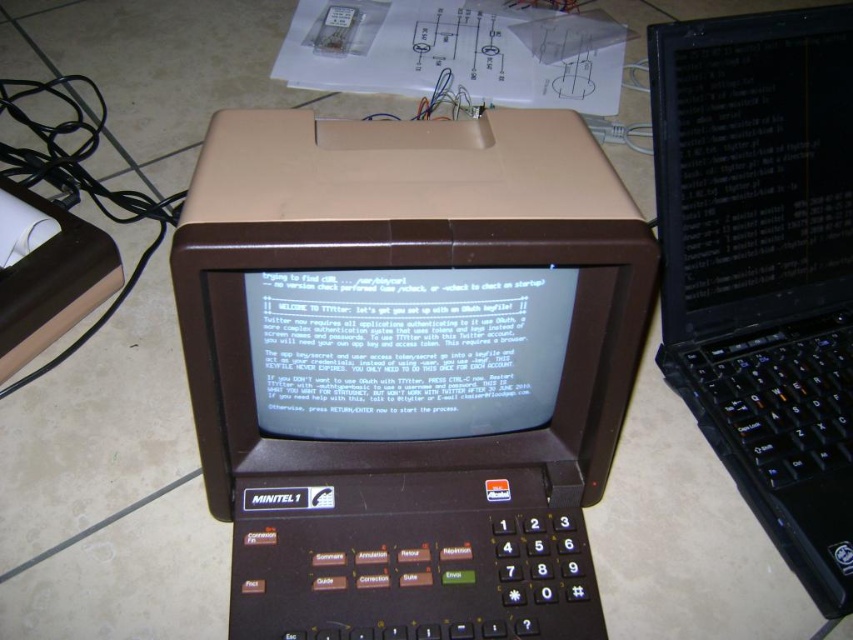
You are a technician who needs to place a new device on a desk. The desk has a coordinate system where the bottom left corner is the origin. The brown plastic minitel 1 at center is already placed at point 0.575, 0.479. If you want to place a new device 10 cm to the right of the minitel, what are the coordinates of the new device?

The new device should be placed at coordinates 0.575 plus 0.10 meters to the right, so the new coordinates would be approximately (408,432).

What is the spatial relationship between the brown plastic minitel 1 at center and the black glossy laptop at upper right in the image?

The brown plastic minitel 1 at center is in front of the black glossy laptop at upper right.